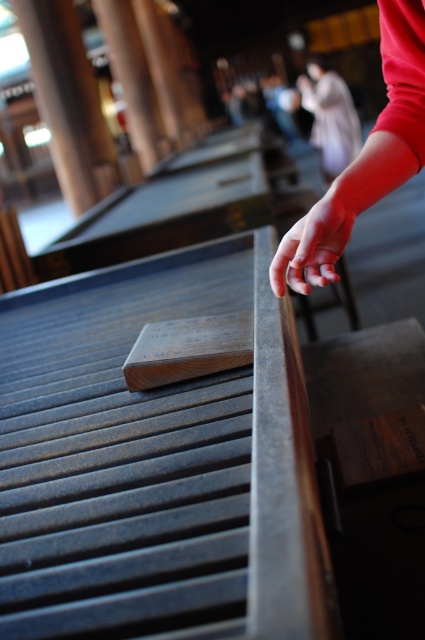
You are standing in a traditional Japanese temple and see two points marked on the wooden platform where your hand is resting. The points are labeled as point [348,204] and point [328,74]. If you were to walk towards the platform, which point would you encounter first?

Point [348,204] is in front of point [328,74], so you would encounter point [348,204] first when approaching the platform.

You are an interior designer assessing the space. You need to place a decorative item that requires a wider surface. Which object between the smooth brown wood at upper left and the smooth beige robe at upper center would you choose?

The smooth brown wood at upper left might be wider than the smooth beige robe at upper center, so you should choose the smooth brown wood at upper left for placing the decorative item.

You are a visitor at a traditional Japanese temple. You see a smooth brown wood at upper left and a smooth beige robe at upper center. Which object is located closer to the bottom of the image?

The smooth brown wood at upper left is positioned under the smooth beige robe at upper center, so it is closer to the bottom of the image.